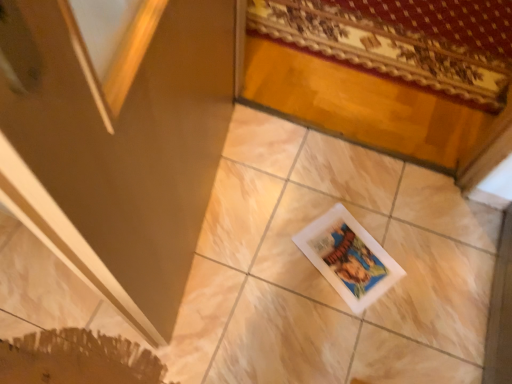
Where is `blank area beneath matte brown screen door at lower left (from a real-world perspective)`? blank area beneath matte brown screen door at lower left (from a real-world perspective) is located at coordinates (212, 239).